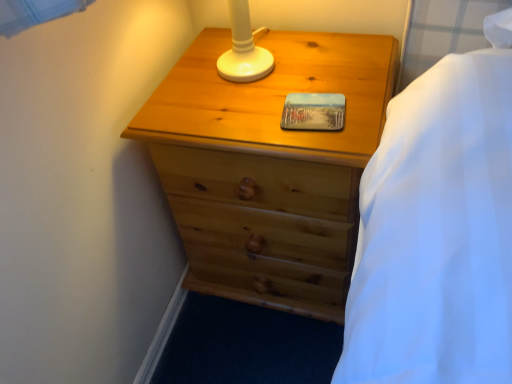
The image size is (512, 384). I want to click on empty space that is ontop of natural wood chest of drawers at center (from a real-world perspective), so click(x=266, y=77).